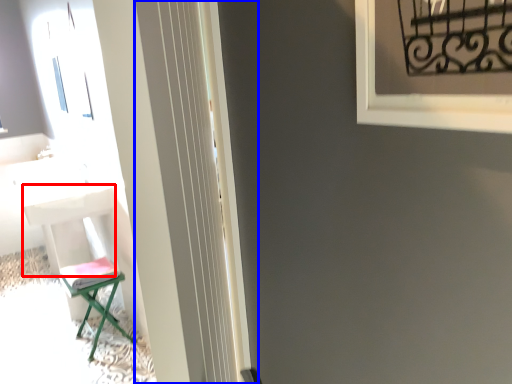
Question: Which object is closer to the camera taking this photo, table (highlighted by a red box) or screen door (highlighted by a blue box)?

Choices:
 (A) table
 (B) screen door

Answer: (B)